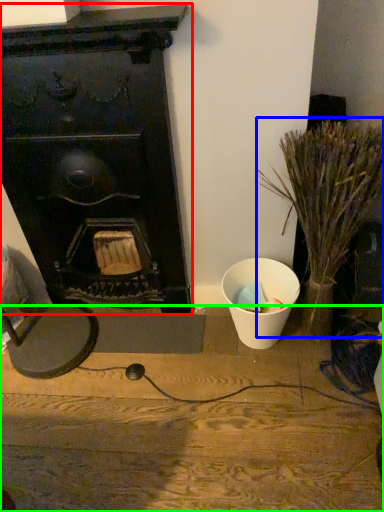
Question: Based on their relative distances, which object is nearer to fireplace (highlighted by a red box)? Choose from plant (highlighted by a blue box) and furniture (highlighted by a green box).

Choices:
 (A) plant
 (B) furniture

Answer: (A)